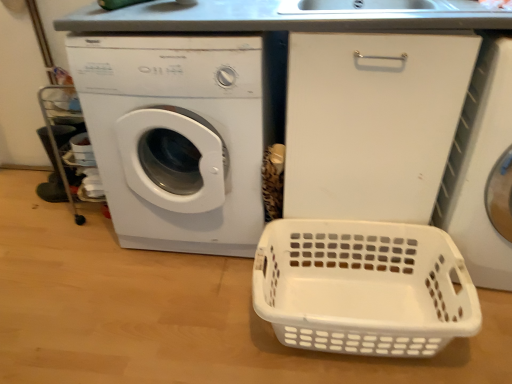
This screenshot has height=384, width=512. Describe the element at coordinates (175, 137) in the screenshot. I see `white plastic washing machine at left, arranged as the second washing machine when viewed from the right` at that location.

Find the location of a particular element. The height and width of the screenshot is (384, 512). white plastic basket at lower right is located at coordinates (362, 287).

Is white plastic washing machine at left, arranged as the second washing machine when viewed from the right, positioned behind white plastic washing machine at right, acting as the 2th washing machine starting from the left?

Yes, white plastic washing machine at left, arranged as the second washing machine when viewed from the right, is behind white plastic washing machine at right, acting as the 2th washing machine starting from the left.

Could you tell me if white plastic washing machine at left, arranged as the second washing machine when viewed from the right, is turned towards white plastic washing machine at right, the 1th washing machine from the right?

No, white plastic washing machine at left, arranged as the second washing machine when viewed from the right, is not facing towards white plastic washing machine at right, the 1th washing machine from the right.

From a real-world perspective, is white plastic washing machine at left, arranged as the second washing machine when viewed from the right, located higher than white plastic washing machine at right, the 1th washing machine from the right?

Yes, from a real-world perspective, white plastic washing machine at left, arranged as the second washing machine when viewed from the right, is on top of white plastic washing machine at right, the 1th washing machine from the right.

Could you tell me if white plastic basket at lower right is turned towards white plastic washing machine at left, the 1th washing machine from the left?

No, white plastic basket at lower right is not aimed at white plastic washing machine at left, the 1th washing machine from the left.

From the image's perspective, is white plastic basket at lower right over white plastic washing machine at left, arranged as the second washing machine when viewed from the right?

No, from the image's perspective, white plastic basket at lower right is not over white plastic washing machine at left, arranged as the second washing machine when viewed from the right.

Between white plastic basket at lower right and white plastic washing machine at left, the 1th washing machine from the left, which one has less height?

Standing shorter between the two is white plastic basket at lower right.

Is white plastic basket at lower right at the left side of white plastic washing machine at left, arranged as the second washing machine when viewed from the right?

In fact, white plastic basket at lower right is to the right of white plastic washing machine at left, arranged as the second washing machine when viewed from the right.

In the image, is white plastic washing machine at left, arranged as the second washing machine when viewed from the right, positioned in front of or behind white plastic basket at lower right?

white plastic washing machine at left, arranged as the second washing machine when viewed from the right, is behind white plastic basket at lower right.

Is white plastic basket at lower right a part of white plastic washing machine at left, the 1th washing machine from the left?

No, white plastic washing machine at left, the 1th washing machine from the left, does not contain white plastic basket at lower right.

In the scene shown: Which point is more distant from viewer, [133,174] or [411,232]?

The point [133,174] is farther.

Is white plastic basket at lower right inside or outside of white plastic washing machine at right, the 1th washing machine from the right?

white plastic basket at lower right exists outside the volume of white plastic washing machine at right, the 1th washing machine from the right.

From the image's perspective, is white plastic basket at lower right located above or below white plastic washing machine at right, the 1th washing machine from the right?

Clearly, from the image's perspective, white plastic basket at lower right is below white plastic washing machine at right, the 1th washing machine from the right.

From a real-world perspective, between white plastic basket at lower right and white plastic washing machine at right, acting as the 2th washing machine starting from the left, who is vertically lower?

white plastic basket at lower right.

Is white plastic basket at lower right far away from white plastic washing machine at right, the 1th washing machine from the right?

Actually, white plastic basket at lower right and white plastic washing machine at right, the 1th washing machine from the right, are a little close together.

Considering the relative positions of white plastic washing machine at right, the 1th washing machine from the right, and white plastic basket at lower right in the image provided, is white plastic washing machine at right, the 1th washing machine from the right, to the left of white plastic basket at lower right from the viewer's perspective?

In fact, white plastic washing machine at right, the 1th washing machine from the right, is to the right of white plastic basket at lower right.

How much distance is there between white plastic washing machine at right, acting as the 2th washing machine starting from the left, and white plastic basket at lower right?

white plastic washing machine at right, acting as the 2th washing machine starting from the left, and white plastic basket at lower right are 13.24 inches apart.

Is white plastic washing machine at right, the 1th washing machine from the right, outside of white plastic basket at lower right?

That's correct, white plastic washing machine at right, the 1th washing machine from the right, is outside of white plastic basket at lower right.

Between white plastic washing machine at right, acting as the 2th washing machine starting from the left, and white plastic basket at lower right, which one has larger size?

white plastic washing machine at right, acting as the 2th washing machine starting from the left, is bigger.

Is white plastic washing machine at right, the 1th washing machine from the right, smaller than white plastic washing machine at left, the 1th washing machine from the left?

Correct, white plastic washing machine at right, the 1th washing machine from the right, occupies less space than white plastic washing machine at left, the 1th washing machine from the left.

Considering the positions of objects white plastic washing machine at right, acting as the 2th washing machine starting from the left, and white plastic washing machine at left, the 1th washing machine from the left, in the image provided, who is behind, white plastic washing machine at right, acting as the 2th washing machine starting from the left, or white plastic washing machine at left, the 1th washing machine from the left,?

white plastic washing machine at left, the 1th washing machine from the left, is behind.

Considering the relative sizes of white plastic washing machine at right, the 1th washing machine from the right, and white plastic washing machine at left, arranged as the second washing machine when viewed from the right, in the image provided, is white plastic washing machine at right, the 1th washing machine from the right, thinner than white plastic washing machine at left, arranged as the second washing machine when viewed from the right,?

No, white plastic washing machine at right, the 1th washing machine from the right, is not thinner than white plastic washing machine at left, arranged as the second washing machine when viewed from the right.

Is white plastic washing machine at right, the 1th washing machine from the right, at the left side of white plastic washing machine at left, the 1th washing machine from the left?

In fact, white plastic washing machine at right, the 1th washing machine from the right, is to the right of white plastic washing machine at left, the 1th washing machine from the left.

You are a GUI agent. You are given a task and a screenshot of the screen. Output one action in this format:
    pyautogui.click(x=<x>, y=<y>)
    Task: Click on the washing machine beneath the white plastic washing machine at left, arranged as the second washing machine when viewed from the right (from a real-world perspective)
    
    Given the screenshot: What is the action you would take?
    pyautogui.click(x=480, y=166)

The height and width of the screenshot is (384, 512). In the image, there is a white plastic washing machine at left, the 1th washing machine from the left. What are the coordinates of `basket below it (from the image's perspective)` in the screenshot? It's located at (362, 287).

Which object lies further to the anchor point white plastic basket at lower right, white plastic washing machine at left, the 1th washing machine from the left, or white plastic washing machine at right, the 1th washing machine from the right?

white plastic washing machine at left, the 1th washing machine from the left, lies further to white plastic basket at lower right than the other object.

Looking at the image, which one is located further to white plastic washing machine at left, arranged as the second washing machine when viewed from the right, white plastic washing machine at right, the 1th washing machine from the right, or white plastic basket at lower right?

white plastic washing machine at right, the 1th washing machine from the right.

Estimate the real-world distances between objects in this image. Which object is closer to white plastic washing machine at right, acting as the 2th washing machine starting from the left, white plastic basket at lower right or white plastic washing machine at left, arranged as the second washing machine when viewed from the right?

Based on the image, white plastic basket at lower right appears to be nearer to white plastic washing machine at right, acting as the 2th washing machine starting from the left.

From the image, which object appears to be farther from white plastic basket at lower right, white plastic washing machine at right, acting as the 2th washing machine starting from the left, or white plastic washing machine at left, arranged as the second washing machine when viewed from the right?

Among the two, white plastic washing machine at left, arranged as the second washing machine when viewed from the right, is located further to white plastic basket at lower right.

Based on their spatial positions, is white plastic basket at lower right or white plastic washing machine at right, acting as the 2th washing machine starting from the left, closer to white plastic washing machine at left, the 1th washing machine from the left?

Among the two, white plastic basket at lower right is located nearer to white plastic washing machine at left, the 1th washing machine from the left.

Estimate the real-world distances between objects in this image. Which object is further from white plastic washing machine at right, the 1th washing machine from the right, white plastic washing machine at left, the 1th washing machine from the left, or white plastic basket at lower right?

white plastic washing machine at left, the 1th washing machine from the left, is further to white plastic washing machine at right, the 1th washing machine from the right.

Locate an element on the screen. basket between white plastic washing machine at left, the 1th washing machine from the left, and white plastic washing machine at right, acting as the 2th washing machine starting from the left, from left to right is located at coordinates (362, 287).